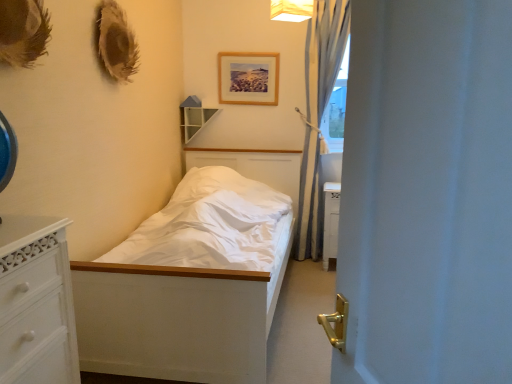
This screenshot has width=512, height=384. I want to click on light blue sheer curtain at right, so click(x=325, y=51).

What are the coordinates of `white fabric lampshade at upper center` in the screenshot? It's located at (291, 10).

What do you see at coordinates (248, 78) in the screenshot? I see `wooden picture frame at upper center` at bounding box center [248, 78].

The height and width of the screenshot is (384, 512). Identify the location of light blue sheer curtain at right. (325, 51).

Is light blue sheer curtain at right to the left or to the right of wooden shelf at upper center in the image?

light blue sheer curtain at right is to the right of wooden shelf at upper center.

Can you tell me how much light blue sheer curtain at right and wooden shelf at upper center differ in facing direction?

The angle between the facing direction of light blue sheer curtain at right and the facing direction of wooden shelf at upper center is 2.6 degrees.

How much distance is there between light blue sheer curtain at right and wooden shelf at upper center?

light blue sheer curtain at right and wooden shelf at upper center are 3.42 feet apart from each other.

Looking at their sizes, would you say light blue sheer curtain at right is wider or thinner than wooden shelf at upper center?

In the image, light blue sheer curtain at right appears to be wider than wooden shelf at upper center.

Is white matte bed at center bigger than white fabric lampshade at upper center?

Correct, white matte bed at center is larger in size than white fabric lampshade at upper center.

Which object is positioned more to the left, white matte bed at center or white fabric lampshade at upper center?

white matte bed at center is more to the left.

Which is nearer, (192, 336) or (306, 15)?

Point (192, 336) appears to be closer to the viewer than point (306, 15).

Is white fabric lampshade at upper center located within white matte bed at center?

No, white fabric lampshade at upper center is located outside of white matte bed at center.

This screenshot has width=512, height=384. What are the coordinates of `bed below the white matte door at center (from a real-world perspective)` in the screenshot? It's located at (185, 289).

Is white matte door at center situated inside white matte bed at center or outside?

white matte door at center is not enclosed by white matte bed at center.

From the image's perspective, which is below, white matte door at center or white matte bed at center?

white matte bed at center, from the image's perspective.

Identify the location of picture frame on the left of white fabric lampshade at upper center. Image resolution: width=512 pixels, height=384 pixels. (248, 78).

Considering the sizes of white fabric lampshade at upper center and wooden picture frame at upper center in the image, is white fabric lampshade at upper center wider or thinner than wooden picture frame at upper center?

Considering their sizes, white fabric lampshade at upper center looks broader than wooden picture frame at upper center.

How many degrees apart are the facing directions of white fabric lampshade at upper center and wooden picture frame at upper center?

The angle between the facing direction of white fabric lampshade at upper center and the facing direction of wooden picture frame at upper center is 27.8 degrees.

Is white matte bed at center turned away from wooden shelf at upper center?

No.

In the scene shown: From the image's perspective, is white matte bed at center on top of wooden shelf at upper center?

No, from the image's perspective, white matte bed at center is not on top of wooden shelf at upper center.

Considering the relative sizes of white matte bed at center and wooden shelf at upper center in the image provided, is white matte bed at center thinner than wooden shelf at upper center?

No.

Based on the photo, considering the sizes of white matte bed at center and wooden shelf at upper center in the image, is white matte bed at center taller or shorter than wooden shelf at upper center?

Clearly, white matte bed at center is taller compared to wooden shelf at upper center.

Considering the relative positions of white matte door at center and wooden picture frame at upper center in the image provided, is white matte door at center to the left or to the right of wooden picture frame at upper center?

From the image, it's evident that white matte door at center is to the right of wooden picture frame at upper center.

From a real-world perspective, does white matte door at center stand above wooden picture frame at upper center?

No, from a real-world perspective, white matte door at center is not over wooden picture frame at upper center

Between white matte door at center and wooden picture frame at upper center, which one has more height?

Standing taller between the two is white matte door at center.

Is point (407, 69) more distant than point (248, 55)?

No.

Does point (229, 79) come behind point (190, 112)?

Yes, point (229, 79) is behind point (190, 112).

Which object is positioned more to the left, wooden picture frame at upper center or wooden shelf at upper center?

wooden shelf at upper center.

From a real-world perspective, is wooden picture frame at upper center above or below wooden shelf at upper center?

wooden picture frame at upper center is above wooden shelf at upper center.

What's the angular difference between wooden picture frame at upper center and wooden shelf at upper center's facing directions?

A: wooden picture frame at upper center and wooden shelf at upper center are facing 2.6 degrees away from each other.

Find the location of a particular element. curtain on the right of wooden shelf at upper center is located at coordinates (325, 51).

This screenshot has height=384, width=512. In order to click on light fixture behind the white matte bed at center in this screenshot , I will do `click(291, 10)`.

Estimate the real-world distances between objects in this image. Which object is closer to wooden picture frame at upper center, white fabric lampshade at upper center or light blue sheer curtain at right?

light blue sheer curtain at right lies closer to wooden picture frame at upper center than the other object.

Considering their positions, is white matte bed at center positioned further to wooden picture frame at upper center than light blue sheer curtain at right?

The object further to wooden picture frame at upper center is white matte bed at center.

From the image, which object appears to be nearer to wooden picture frame at upper center, white matte door at center or wooden shelf at upper center?

wooden shelf at upper center lies closer to wooden picture frame at upper center than the other object.

Estimate the real-world distances between objects in this image. Which object is further from white matte bed at center, light blue sheer curtain at right or white fabric lampshade at upper center?

white fabric lampshade at upper center.

From the image, which object appears to be farther from white matte door at center, white fabric lampshade at upper center or wooden shelf at upper center?

wooden shelf at upper center is further to white matte door at center.

Considering their positions, is wooden shelf at upper center positioned closer to white matte bed at center than light blue sheer curtain at right?

light blue sheer curtain at right lies closer to white matte bed at center than the other object.

When comparing their distances from light blue sheer curtain at right, does white matte bed at center or white matte door at center seem further?

white matte door at center lies further to light blue sheer curtain at right than the other object.

Which object lies further to the anchor point white matte door at center, white matte bed at center or wooden shelf at upper center?

wooden shelf at upper center lies further to white matte door at center than the other object.

At what (x,y) coordinates should I click in order to perform the action: click on picture frame between white fabric lampshade at upper center and wooden shelf at upper center from front to back. Please return your answer as a coordinate pair (x, y). The image size is (512, 384). Looking at the image, I should click on (248, 78).

Identify the location of bed positioned between white matte door at center and wooden picture frame at upper center from near to far. (185, 289).

Locate an element on the screen. curtain between white matte door at center and wooden shelf at upper center from front to back is located at coordinates (325, 51).

Where is `light fixture between white matte door at center and light blue sheer curtain at right along the z-axis`? light fixture between white matte door at center and light blue sheer curtain at right along the z-axis is located at coordinates (291, 10).